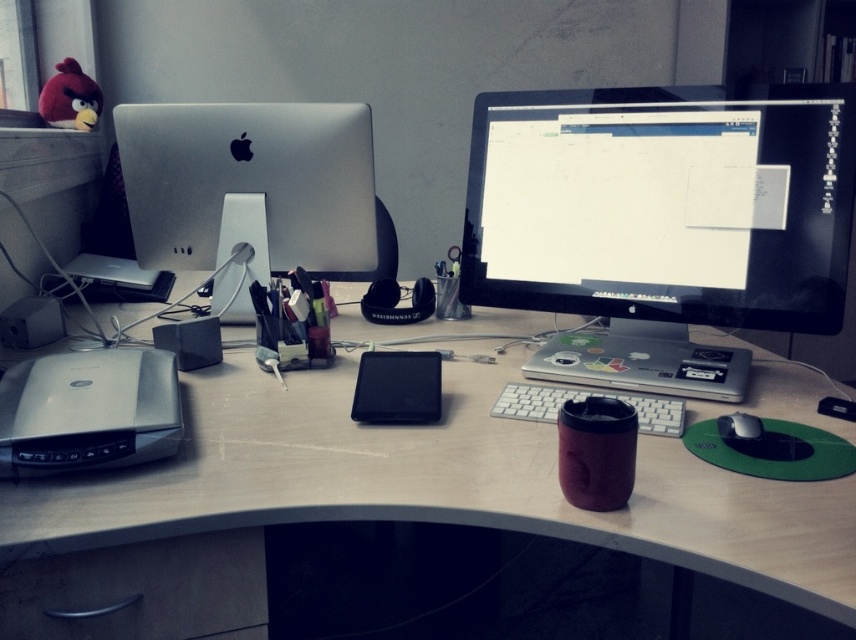
You are a delivery robot that needs to place a package between the matte black monitor at center and the black matte mouse at center right. The package is 40 centimeters long. Can the package fit between them?

The distance between the matte black monitor at center and the black matte mouse at center right is 40.01 centimeters. Since the package is 40 centimeters long, there is just enough space for it to fit between them with a small gap remaining.

You are a graphic designer working on a project and need to place a new matte black monitor at center on your desk. Given the current layout described in the scene, where should you position it to avoid blocking the existing iMacs and the flatbed scanner?

The matte black monitor at center should be placed at point (663, 204) to avoid blocking the existing iMacs and the flatbed scanner as specified in the scene description.

You are setting up a new speaker in your workspace. You want to place it closer to the viewer than the existing matte black monitor at center. Is the current placement of the white plastic speaker at center correct?

The matte black monitor at center is closer to the viewer than the white plastic speaker at center. Therefore, the white plastic speaker at center is not placed correctly because it needs to be closer to the viewer than the matte black monitor at center.